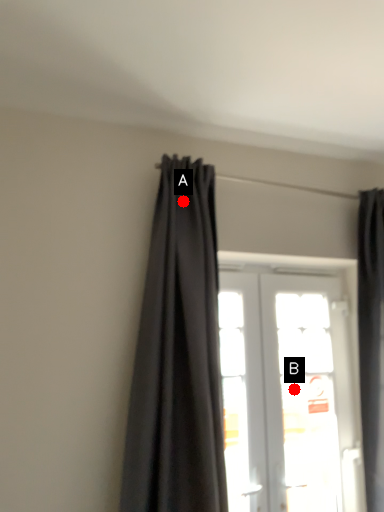
Question: Two points are circled on the image, labeled by A and B beside each circle. Which point is closer to the camera taking this photo?

Choices:
 (A) A is closer
 (B) B is closer

Answer: (A)